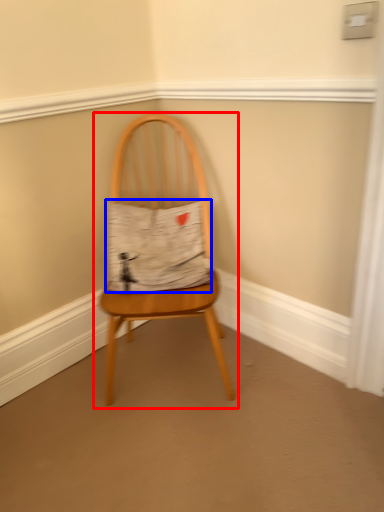
Question: Among these objects, which one is nearest to the camera, chair (highlighted by a red box) or fabric (highlighted by a blue box)?

Choices:
 (A) chair
 (B) fabric

Answer: (A)